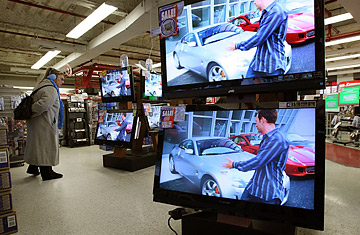
The image size is (360, 235). I want to click on tv, so click(116, 90), click(122, 120), click(225, 55), click(218, 146).